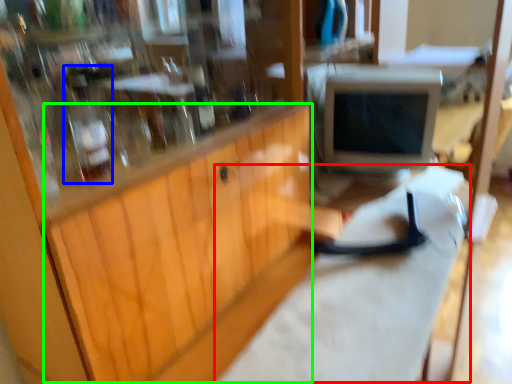
Question: Which object is positioned closest to workbench (highlighted by a red box)? Select from bottle (highlighted by a blue box) and wood (highlighted by a green box).

Choices:
 (A) bottle
 (B) wood

Answer: (B)